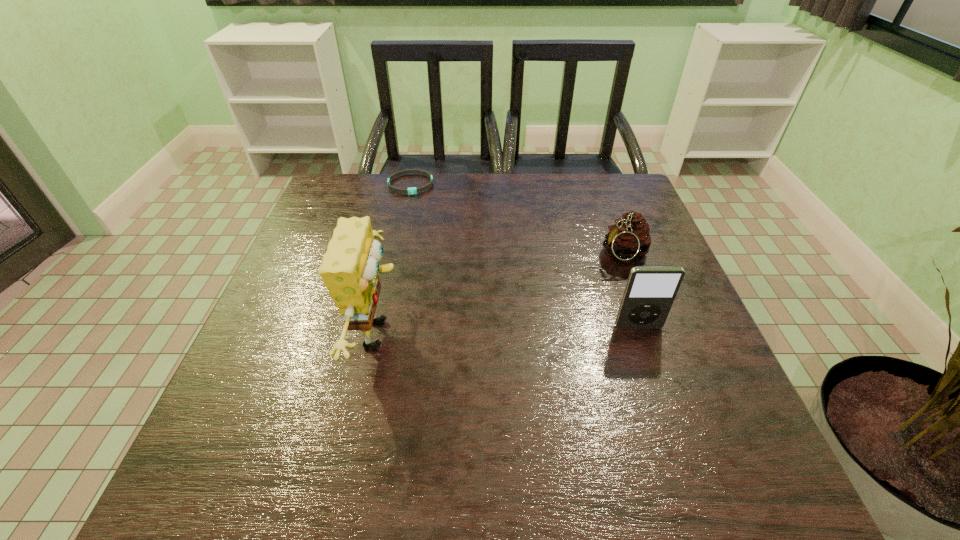
This screenshot has height=540, width=960. Find the location of `sponge`. sponge is located at coordinates (350, 270).

You are a GUI agent. You are given a task and a screenshot of the screen. Output one action in this format:
    pyautogui.click(x=<x>, y=<y>)
    Task: Click on the third shortest object
    Image resolution: width=960 pixels, height=540 pixels.
    Given the screenshot: What is the action you would take?
    pyautogui.click(x=649, y=294)

Where is `the shortest object`? The image size is (960, 540). the shortest object is located at coordinates (413, 190).

Locate an element on the screen. the farthest object is located at coordinates point(413,190).

At what (x,y) coordinates should I click in order to perform the action: click on the second farthest object. Please return your answer as a coordinate pair (x, y). Looking at the image, I should click on (630, 240).

Identify the location of pinecone. (630, 240).

Where is `free region located 0.240m on the face of the tallest object`? This screenshot has width=960, height=540. free region located 0.240m on the face of the tallest object is located at coordinates (521, 333).

At what (x,y) coordinates should I click in order to perform the action: click on blank area located on the front-facing side of the iPod. Please return your answer as a coordinate pair (x, y). Image resolution: width=960 pixels, height=540 pixels. Looking at the image, I should click on (671, 422).

Find the location of `free spot located 0.200m on the buckle of the farthest object`. free spot located 0.200m on the buckle of the farthest object is located at coordinates (433, 234).

Where is `vacant space located on the buckle of the farthest object`? This screenshot has height=540, width=960. vacant space located on the buckle of the farthest object is located at coordinates (427, 220).